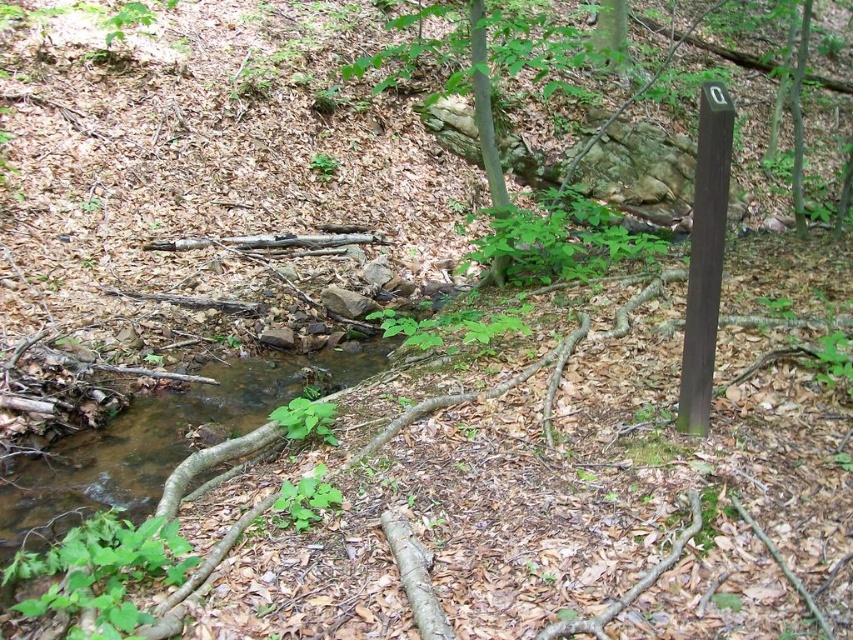
You are a hiker trying to cross the stream. You see the clear water stream at center and the brown smooth pole at right. Which one is wider?

The clear water stream at center is wider than the brown smooth pole at right.

Based on the photo, you are a hiker trying to cross the stream. You see the clear water stream at center and the brown smooth pole at right. Which object is closer to your left side when facing the stream?

The clear water stream at center is to the left of the brown smooth pole at right, so when facing the stream, the clear water stream at center will be closer to your left side.

You are a hiker trying to cross the stream. You see the clear water stream at center and the brown smooth pole at right. Which object is shorter in height?

The clear water stream at center has a lesser height compared to the brown smooth pole at right, so the clear water stream at center is shorter in height.